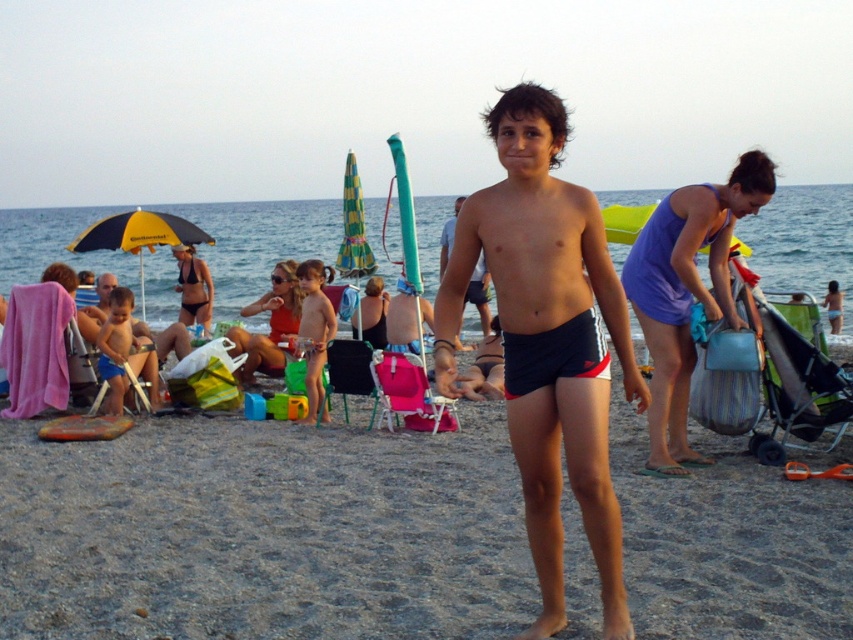
Question: Among these objects, which one is nearest to the camera?

Choices:
 (A) black fabric shorts at center
 (B) smooth black shorts at center
 (C) matte black shorts at center

Answer: (B)

Question: Does matte black shorts at center appear over smooth black shorts at center?

Choices:
 (A) yes
 (B) no

Answer: (B)

Question: Is dark blue swim trunks at center positioned behind smooth black shorts at center?

Choices:
 (A) no
 (B) yes

Answer: (A)

Question: Which of the following is the closest to the observer?

Choices:
 (A) smooth black shorts at center
 (B) smooth tan skin at center

Answer: (A)

Question: Considering the relative positions of dark blue swim trunks at center and yellowmaterial/textureumbrella at left in the image provided, where is dark blue swim trunks at center located with respect to yellowmaterial/textureumbrella at left?

Choices:
 (A) below
 (B) above

Answer: (A)

Question: Among these points, which one is farthest from the camera?

Choices:
 (A) (476, 211)
 (B) (461, 196)
 (C) (689, 460)

Answer: (B)